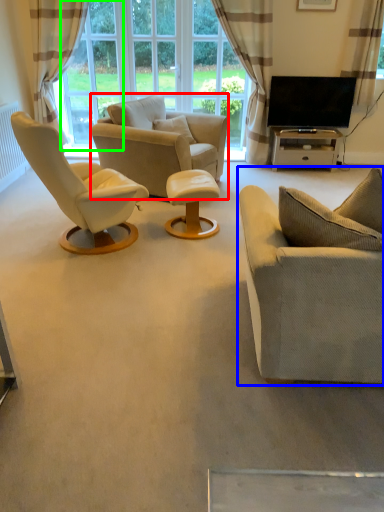
Question: Which object is positioned farthest from chair (highlighted by a red box)? Select from studio couch (highlighted by a blue box) and window screen (highlighted by a green box).

Choices:
 (A) studio couch
 (B) window screen

Answer: (A)